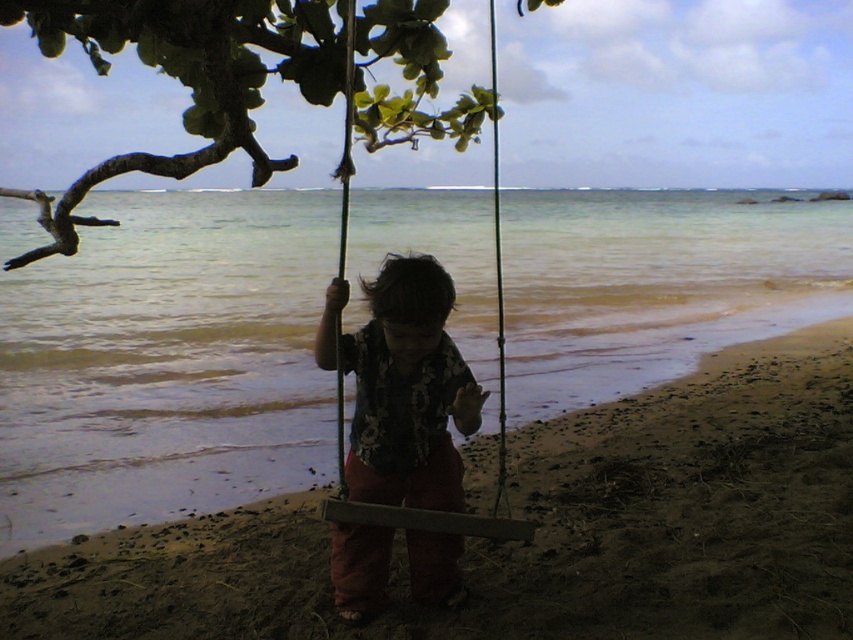
Question: Which of the following is the closest to the observer?

Choices:
 (A) wooden swing at center
 (B) green leafy branch at upper left
 (C) floral shirt at center

Answer: (B)

Question: Can you confirm if brown sandy beach at center is positioned below green leafy branch at upper left?

Choices:
 (A) yes
 (B) no

Answer: (A)

Question: Which point is farther from the camera taking this photo?

Choices:
 (A) (354, 49)
 (B) (434, 577)
 (C) (544, 481)

Answer: (C)

Question: From the image, what is the correct spatial relationship of green leafy branch at upper left in relation to floral shirt at center?

Choices:
 (A) above
 (B) below

Answer: (A)

Question: Which object appears farthest from the camera in this image?

Choices:
 (A) green leafy branch at upper left
 (B) floral shirt at center
 (C) wooden swing at center

Answer: (B)

Question: Considering the relative positions of brown sandy beach at center and green leafy branch at upper left in the image provided, where is brown sandy beach at center located with respect to green leafy branch at upper left?

Choices:
 (A) below
 (B) above

Answer: (A)